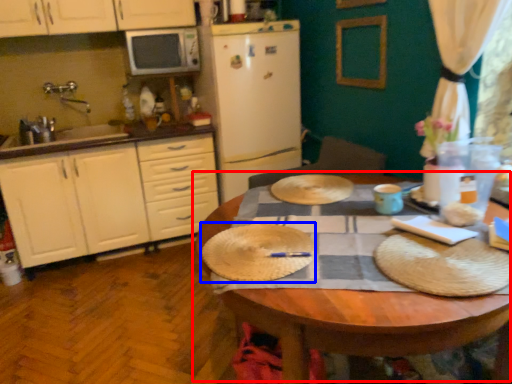
Question: Which of the following is the farthest to the observer, table (highlighted by a red box) or paper plate (highlighted by a blue box)?

Choices:
 (A) table
 (B) paper plate

Answer: (B)